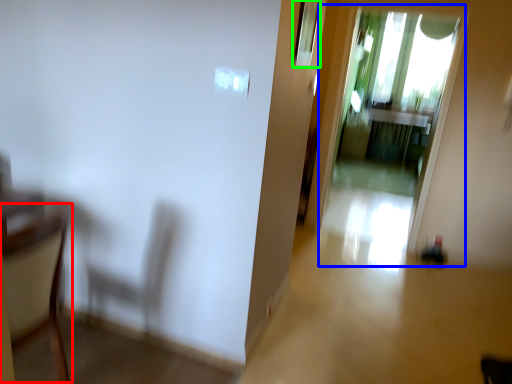
Question: Which object is positioned farthest from armchair (highlighted by a red box)? Select from screen door (highlighted by a blue box) and window (highlighted by a green box).

Choices:
 (A) screen door
 (B) window

Answer: (A)